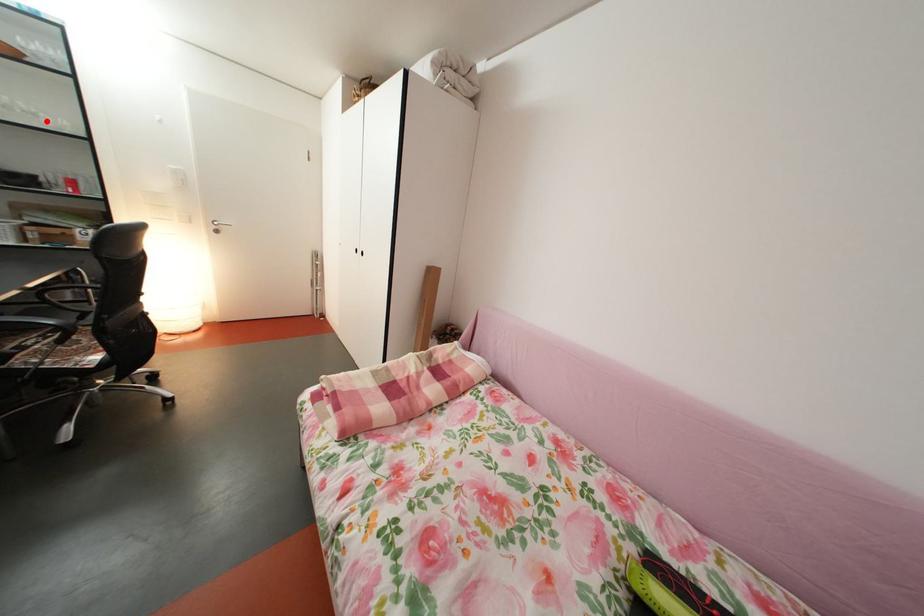
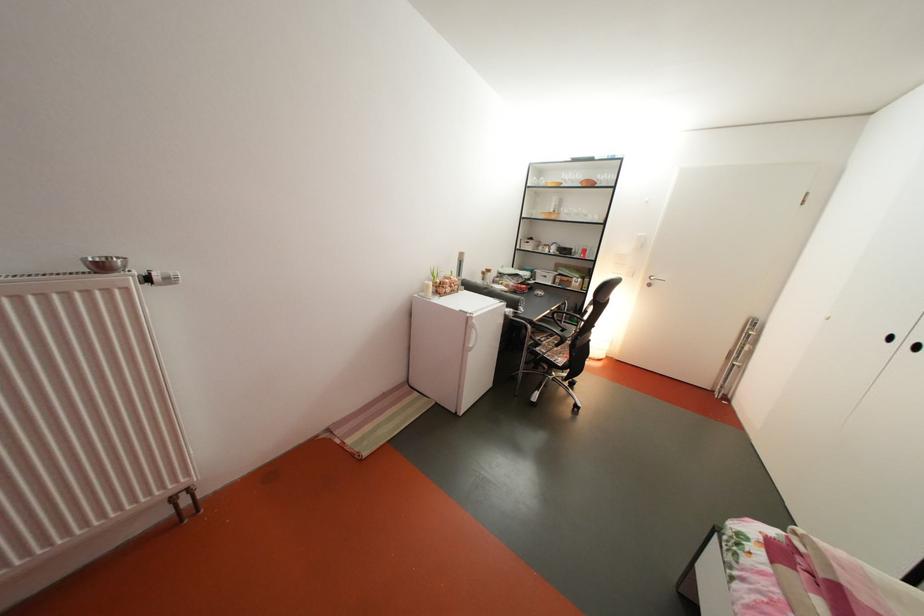
Find the pixel in the second image that matches the highlighted location in the first image.

(598, 222)